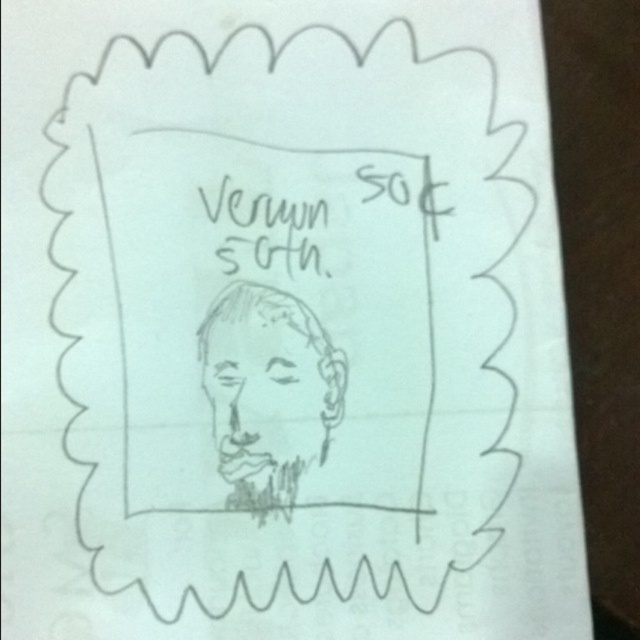
Based on the coordinates provided in the scene description, where exactly is the sketchy pencil man at center located?

The sketchy pencil man at center is located at point (268, 394).

You are examining the sketch of the person with closed eyes in the rectangular frame. There are two points marked on the drawing at coordinates point (342, 368) and point (273, 216). From your perspective, which point is closer to you?

Point (342, 368) is closer to the camera than point (273, 216).

What is located at the coordinate point (268, 394) in the drawing?

The sketchy pencil man at center is located at point (268, 394).